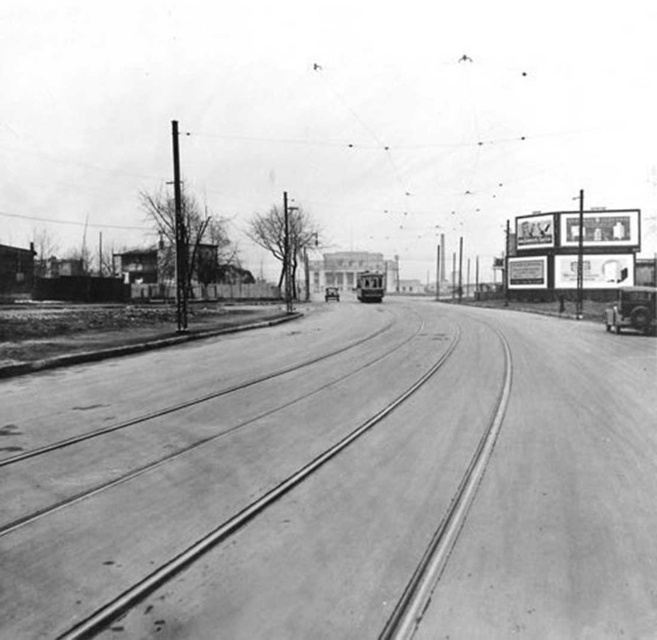
Question: Which of these objects is positioned closest to the polished brass tram at center?

Choices:
 (A) shiny silver car at right
 (B) metallic silver car at center

Answer: (B)

Question: Among these points, which one is farthest from the camera?

Choices:
 (A) (332, 292)
 (B) (390, 547)
 (C) (382, 282)

Answer: (A)

Question: Observing the image, what is the correct spatial positioning of smooth asphalt train track at center in reference to metallic silver car at center?

Choices:
 (A) left
 (B) right

Answer: (B)

Question: Estimate the real-world distances between objects in this image. Which object is farther from the metallic silver car at center?

Choices:
 (A) smooth asphalt train track at center
 (B) polished brass tram at center
 (C) shiny silver car at right

Answer: (A)

Question: Can you confirm if smooth asphalt train track at center is positioned above polished brass tram at center?

Choices:
 (A) no
 (B) yes

Answer: (A)

Question: Where is shiny silver car at right located in relation to metallic silver car at center in the image?

Choices:
 (A) below
 (B) above

Answer: (A)